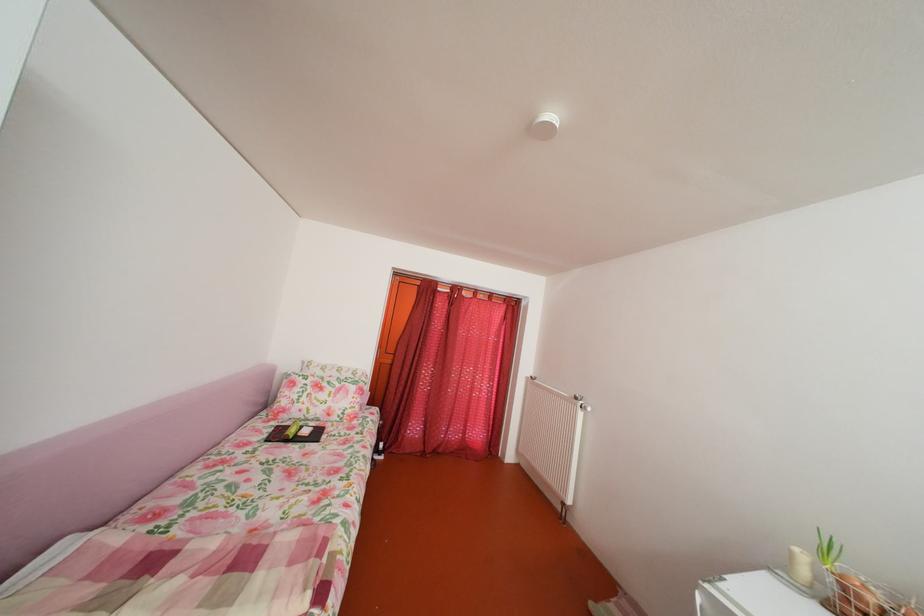
Find where to turn the radiator knob. Please return your answer as a coordinate pair (x, y).

(582, 405)